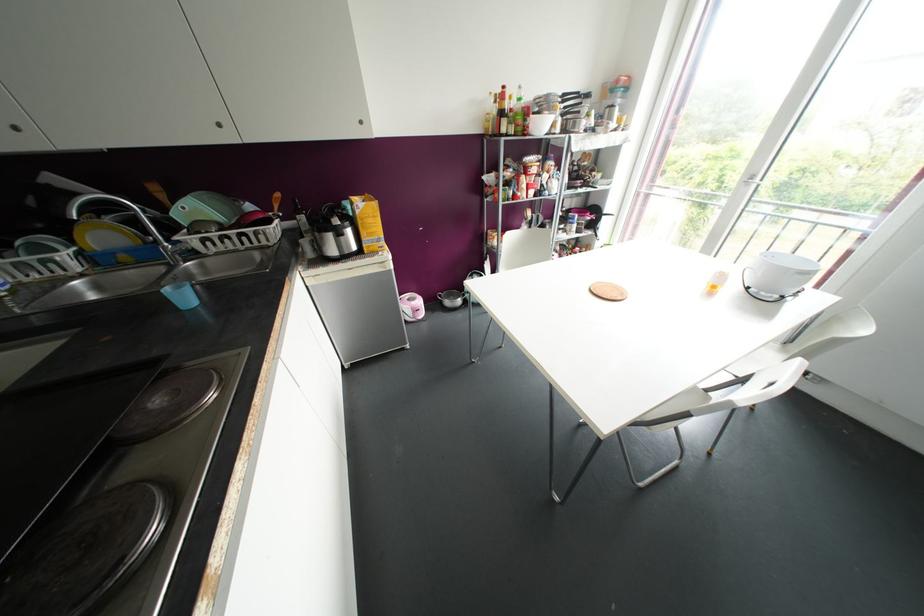
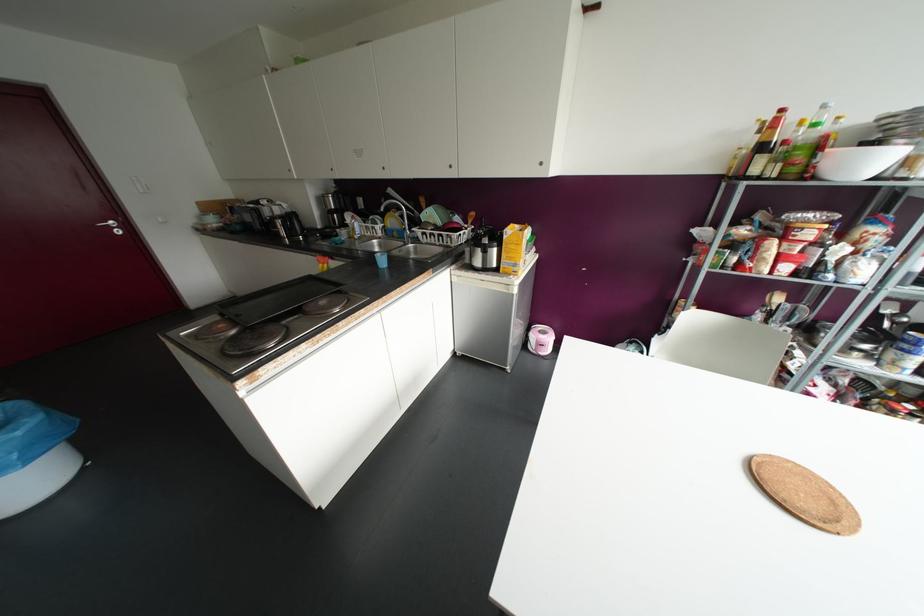
Find the pixel in the second image that matches [503,86] in the first image.

(781, 110)